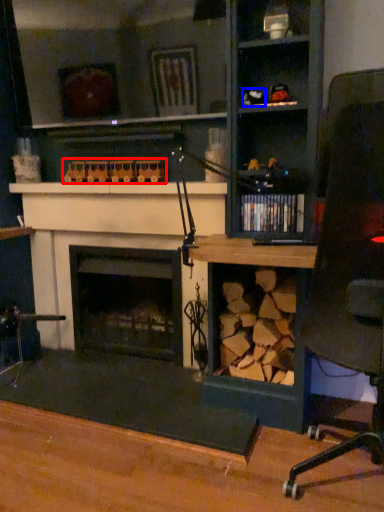
Question: Which of the following is the farthest to the observer, toy (highlighted by a red box) or toy (highlighted by a blue box)?

Choices:
 (A) toy
 (B) toy

Answer: (A)